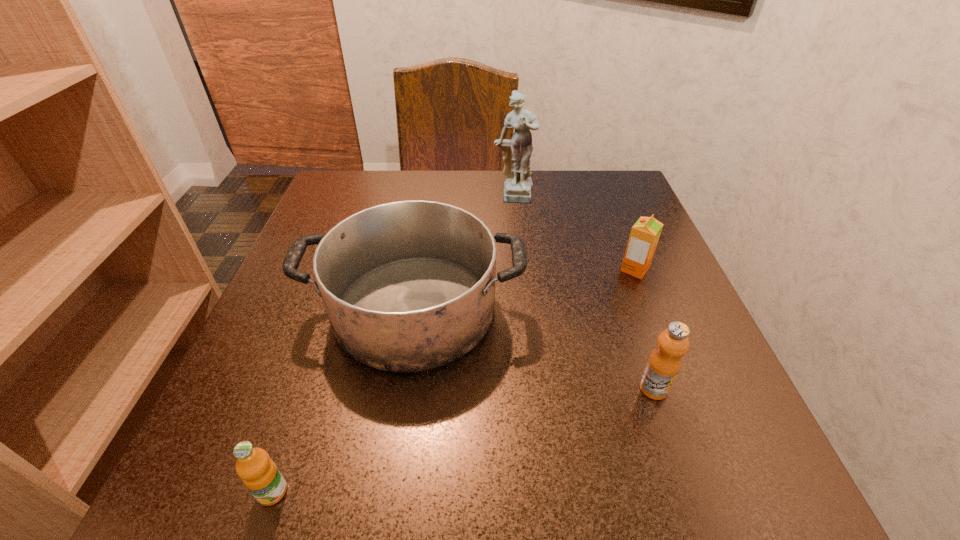
You are a GUI agent. You are given a task and a screenshot of the screen. Output one action in this format:
    pyautogui.click(x=<x>, y=<y>)
    Task: Click on the figurine
    The height and width of the screenshot is (540, 960).
    Given the screenshot: What is the action you would take?
    pyautogui.click(x=517, y=188)

The height and width of the screenshot is (540, 960). I want to click on the tallest object, so click(x=517, y=188).

The height and width of the screenshot is (540, 960). Identify the location of saucepan. tap(408, 286).

The width and height of the screenshot is (960, 540). I want to click on the second nearest object, so click(664, 363).

You are a GUI agent. You are given a task and a screenshot of the screen. Output one action in this format:
    pyautogui.click(x=<x>, y=<y>)
    Task: Click on the farthest orange juice
    The width and height of the screenshot is (960, 540).
    Given the screenshot: What is the action you would take?
    pyautogui.click(x=644, y=236)

I want to click on the leftmost orange juice, so click(259, 473).

Image resolution: width=960 pixels, height=540 pixels. In order to click on the nearest object in this screenshot , I will do point(259,473).

Locate an element on the screen. The width and height of the screenshot is (960, 540). vacant space situated 0.110m on the front-facing side of the farthest object is located at coordinates (516, 239).

Locate an element on the screen. The height and width of the screenshot is (540, 960). blank space located on the right of the saucepan is located at coordinates (688, 309).

I want to click on vacant point located on the front label of the second nearest object, so click(x=682, y=470).